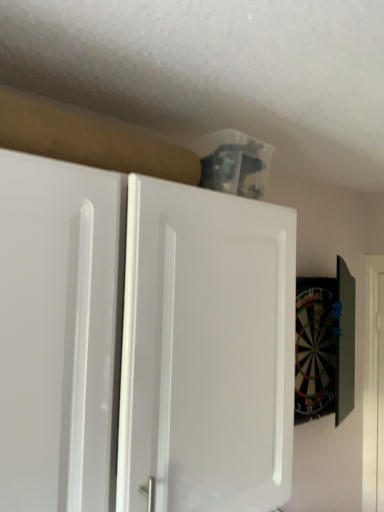
Question: From the image's perspective, does white matte cabinet at upper center appear higher than white smooth door at right?

Choices:
 (A) no
 (B) yes

Answer: (B)

Question: From a real-world perspective, is white matte cabinet at upper center on white smooth door at right?

Choices:
 (A) no
 (B) yes

Answer: (B)

Question: Is white matte cabinet at upper center facing towards white smooth door at right?

Choices:
 (A) yes
 (B) no

Answer: (B)

Question: Is white matte cabinet at upper center behind white smooth door at right?

Choices:
 (A) no
 (B) yes

Answer: (A)

Question: Does white matte cabinet at upper center have a larger size compared to white smooth door at right?

Choices:
 (A) no
 (B) yes

Answer: (B)

Question: From a real-world perspective, is white matte cabinet at upper center under white smooth door at right?

Choices:
 (A) yes
 (B) no

Answer: (B)

Question: Is white smooth door at right outside white matte cabinet at upper center?

Choices:
 (A) no
 (B) yes

Answer: (B)

Question: Does white smooth door at right have a lesser width compared to white matte cabinet at upper center?

Choices:
 (A) no
 (B) yes

Answer: (B)

Question: Can you confirm if white smooth door at right is positioned to the left of white matte cabinet at upper center?

Choices:
 (A) yes
 (B) no

Answer: (B)

Question: Considering the relative sizes of white smooth door at right and white matte cabinet at upper center in the image provided, is white smooth door at right bigger than white matte cabinet at upper center?

Choices:
 (A) no
 (B) yes

Answer: (A)

Question: Is white smooth door at right taller than white matte cabinet at upper center?

Choices:
 (A) no
 (B) yes

Answer: (B)

Question: Is white matte cabinet at upper center inside white smooth door at right?

Choices:
 (A) no
 (B) yes

Answer: (A)

Question: Which is correct: white smooth door at right is inside white matte cabinet at upper center, or outside of it?

Choices:
 (A) inside
 (B) outside

Answer: (B)